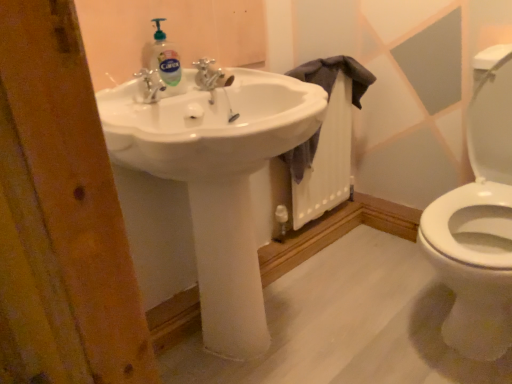
Describe the element at coordinates (210, 75) in the screenshot. The height and width of the screenshot is (384, 512). I see `silver metallic faucet at center` at that location.

The image size is (512, 384). Identify the location of clear liquid soap at upper center. (167, 63).

This screenshot has height=384, width=512. I want to click on white glossy sink at center, so click(x=217, y=180).

Is silver metallic faucet at center in front of or behind clear liquid soap at upper center in the image?

silver metallic faucet at center is positioned farther from the viewer than clear liquid soap at upper center.

Is silver metallic faucet at center looking in the opposite direction of clear liquid soap at upper center?

No.

Are silver metallic faucet at center and clear liquid soap at upper center beside each other?

Absolutely, silver metallic faucet at center is next to and touching clear liquid soap at upper center.

From a real-world perspective, which object rests below the other?

silver metallic faucet at center is physically lower.

How far apart are dark gray fabric at sink and clear liquid soap at upper center?

A distance of 58.67 centimeters exists between dark gray fabric at sink and clear liquid soap at upper center.

Does dark gray fabric at sink turn towards clear liquid soap at upper center?

No, dark gray fabric at sink does not turn towards clear liquid soap at upper center.

How many degrees apart are the facing directions of dark gray fabric at sink and clear liquid soap at upper center?

0.00352 degrees separate the facing orientations of dark gray fabric at sink and clear liquid soap at upper center.

Is clear liquid soap at upper center inside dark gray fabric at sink?

No.

Is the surface of dark gray fabric at sink in direct contact with white glossy sink at center?

No, dark gray fabric at sink is not touching white glossy sink at center.

Could you tell me if dark gray fabric at sink is facing white glossy sink at center?

No, dark gray fabric at sink is not aimed at white glossy sink at center.

Considering the sizes of dark gray fabric at sink and white glossy sink at center in the image, is dark gray fabric at sink bigger or smaller than white glossy sink at center?

Considering their sizes, dark gray fabric at sink takes up less space than white glossy sink at center.

Is point (321, 83) positioned after point (208, 312)?

Yes.

Would you say silver metallic faucet at center is inside or outside white glossy sink at center?

silver metallic faucet at center fits inside white glossy sink at center.

Does point (198, 83) come behind point (245, 347)?

That is False.

Considering the relative positions of silver metallic faucet at center and white glossy sink at center in the image provided, is silver metallic faucet at center to the left or to the right of white glossy sink at center?

silver metallic faucet at center is positioned on white glossy sink at center's left side.

How many degrees apart are the facing directions of silver metallic faucet at center and white glossy sink at center?

silver metallic faucet at center and white glossy sink at center are facing 0.00162 degrees away from each other.

How far apart are clear liquid soap at upper center and silver metallic faucet at center?

clear liquid soap at upper center and silver metallic faucet at center are 3.49 inches apart.

Can you tell me how much clear liquid soap at upper center and silver metallic faucet at center differ in facing direction?

The angular difference between clear liquid soap at upper center and silver metallic faucet at center is 0.0042 degrees.

From the image's perspective, who appears lower, clear liquid soap at upper center or silver metallic faucet at center?

From the image's view, clear liquid soap at upper center is below.

In the scene shown: From a real-world perspective, is clear liquid soap at upper center positioned under silver metallic faucet at center based on gravity?

Incorrect, from a real-world perspective, clear liquid soap at upper center is higher than silver metallic faucet at center.

Is clear liquid soap at upper center completely or partially outside of dark gray fabric at sink?

Yes, clear liquid soap at upper center is located beyond the bounds of dark gray fabric at sink.

Identify the location of cleaning product in front of the dark gray fabric at sink. The height and width of the screenshot is (384, 512). (167, 63).

Can you tell me how much clear liquid soap at upper center and dark gray fabric at sink differ in facing direction?

0.00352 degrees separate the facing orientations of clear liquid soap at upper center and dark gray fabric at sink.

Which is less distant, (x=175, y=79) or (x=331, y=69)?

Point (x=175, y=79) appears to be closer to the viewer than point (x=331, y=69).

Does silver metallic faucet at center have a lesser height compared to dark gray fabric at sink?

Indeed, silver metallic faucet at center has a lesser height compared to dark gray fabric at sink.

How many degrees apart are the facing directions of silver metallic faucet at center and dark gray fabric at sink?

The angle between the facing direction of silver metallic faucet at center and the facing direction of dark gray fabric at sink is 0.00233 degrees.

From a real-world perspective, is silver metallic faucet at center located higher than dark gray fabric at sink?

Yes, from a real-world perspective, silver metallic faucet at center is on top of dark gray fabric at sink.

Is silver metallic faucet at center with dark gray fabric at sink?

There is a gap between silver metallic faucet at center and dark gray fabric at sink.

In the image, there is a silver metallic faucet at center. Identify the location of cleaning product below it (from the image's perspective). The height and width of the screenshot is (384, 512). (167, 63).

The image size is (512, 384). Identify the location of cleaning product above the dark gray fabric at sink (from a real-world perspective). (167, 63).

From the image, which object appears to be farther from white glossy sink at center, clear liquid soap at upper center or silver metallic faucet at center?

silver metallic faucet at center.

In the scene shown: When comparing their distances from clear liquid soap at upper center, does white glossy sink at center or dark gray fabric at sink seem closer?

white glossy sink at center is positioned closer to the anchor clear liquid soap at upper center.

Which object lies nearer to the anchor point dark gray fabric at sink, silver metallic faucet at center or white glossy sink at center?

silver metallic faucet at center.

Estimate the real-world distances between objects in this image. Which object is closer to clear liquid soap at upper center, dark gray fabric at sink or silver metallic faucet at center?

silver metallic faucet at center.

Based on their spatial positions, is white glossy sink at center or dark gray fabric at sink further from silver metallic faucet at center?

Based on the image, dark gray fabric at sink appears to be further to silver metallic faucet at center.

In the scene shown: When comparing their distances from white glossy sink at center, does dark gray fabric at sink or clear liquid soap at upper center seem closer?

clear liquid soap at upper center lies closer to white glossy sink at center than the other object.

In the scene shown: Which object lies further to the anchor point silver metallic faucet at center, dark gray fabric at sink or white glossy sink at center?

The object further to silver metallic faucet at center is dark gray fabric at sink.

From the picture: Considering their positions, is silver metallic faucet at center positioned further to dark gray fabric at sink than clear liquid soap at upper center?

Among the two, clear liquid soap at upper center is located further to dark gray fabric at sink.

Identify the location of cleaning product between silver metallic faucet at center and white glossy sink at center vertically. (167, 63).

The height and width of the screenshot is (384, 512). I want to click on cleaning product located between white glossy sink at center and dark gray fabric at sink in the depth direction, so click(167, 63).

Identify the location of tap between clear liquid soap at upper center and dark gray fabric at sink. (210, 75).

In order to click on tap between white glossy sink at center and dark gray fabric at sink in the front-back direction in this screenshot , I will do `click(210, 75)`.